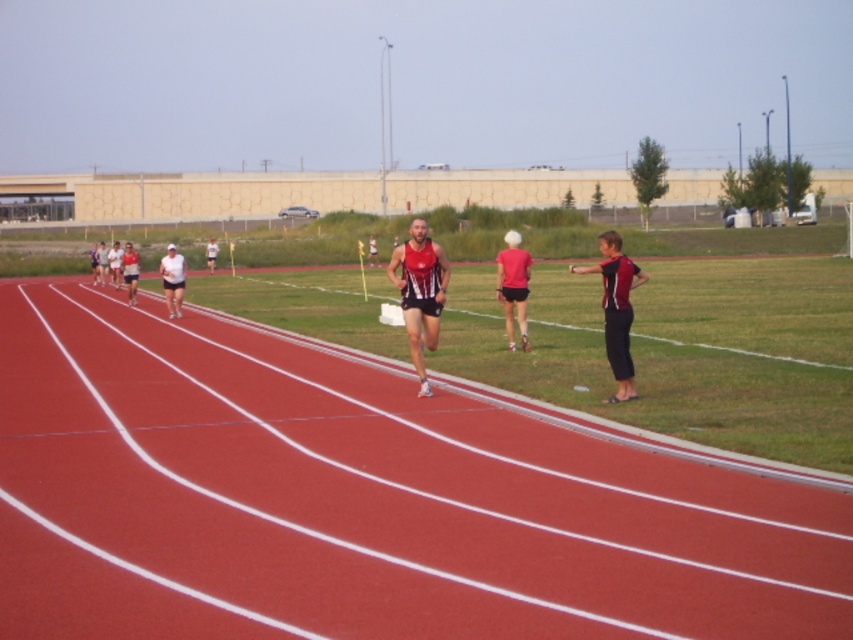
Does rubberized red track at center appear under white matte shirt at center?

Indeed, rubberized red track at center is positioned under white matte shirt at center.

Is point (258, 609) in front of point (173, 260)?

That is True.

Where is `rubberized red track at center`? Image resolution: width=853 pixels, height=640 pixels. rubberized red track at center is located at coordinates (358, 500).

You are a GUI agent. You are given a task and a screenshot of the screen. Output one action in this format:
    pyautogui.click(x=<x>, y=<y>)
    Task: Click on the rubberized red track at center
    This screenshot has height=640, width=853.
    Given the screenshot: What is the action you would take?
    pyautogui.click(x=358, y=500)

From the picture: Does matte red and black uniform at right lie behind matte pink shirt at center?

No, matte red and black uniform at right is in front of matte pink shirt at center.

Does matte red and black uniform at right have a lesser width compared to matte pink shirt at center?

No.

Which is behind, point (614, 368) or point (508, 316)?

Point (508, 316)

Identify the location of matte red and black uniform at right. This screenshot has height=640, width=853. (616, 308).

Who is more distant from viewer, (415, 316) or (625, 344)?

The point (415, 316) is behind.

Is point (437, 326) more distant than point (630, 321)?

Yes, it is.

At what (x,y) coordinates should I click in order to perform the action: click on matte red running suit at center. Please return your answer as a coordinate pair (x, y). This screenshot has height=640, width=853. Looking at the image, I should click on (421, 292).

I want to click on matte red running suit at center, so click(x=421, y=292).